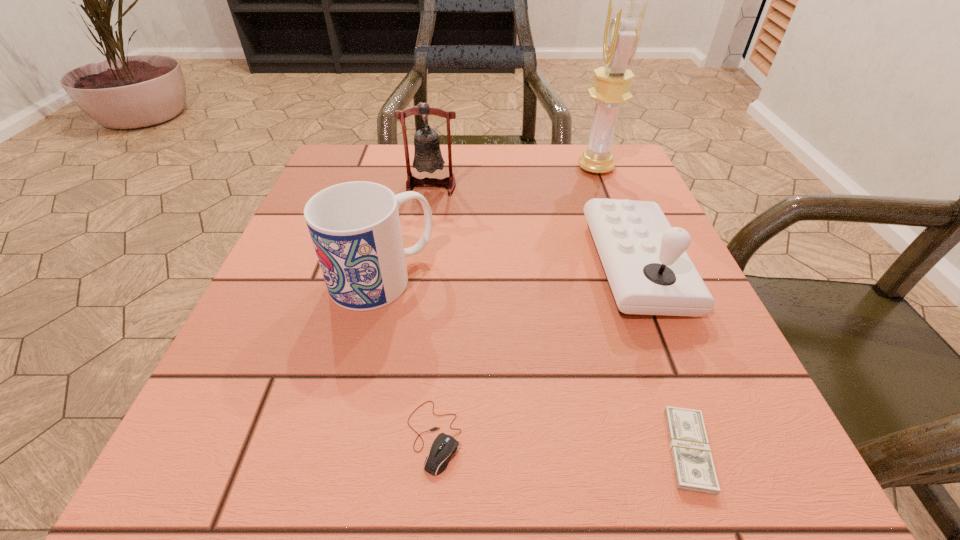
The height and width of the screenshot is (540, 960). What are the coordinates of `free space at the near right corner of the desktop` in the screenshot? It's located at (754, 468).

The image size is (960, 540). What are the coordinates of `free spot between the joystick and the second shortest object` in the screenshot? It's located at (535, 351).

What are the coordinates of `vacant space that is in between the computer mouse and the shortest object` in the screenshot? It's located at (561, 443).

Identify the location of blank region between the bell and the mug. (406, 232).

In order to click on empty space that is in between the award and the bell in this screenshot , I will do `click(514, 177)`.

This screenshot has height=540, width=960. Identify the location of unoccupied area between the mug and the money. (535, 364).

You are a GUI agent. You are given a task and a screenshot of the screen. Output one action in this format:
    pyautogui.click(x=<x>, y=<y>)
    Task: Click on the free space between the joystick and the computer mouse
    The height and width of the screenshot is (540, 960).
    Given the screenshot: What is the action you would take?
    pyautogui.click(x=535, y=351)

Identify the location of the closest object to the joystick. Image resolution: width=960 pixels, height=540 pixels. (694, 470).

Image resolution: width=960 pixels, height=540 pixels. I want to click on the closest object to the money, so click(x=649, y=272).

Image resolution: width=960 pixels, height=540 pixels. Identify the location of free spot that satisfies the following two spatial constraints: 1. on the front side of the shortest object; 2. on the right side of the computer mouse. (432, 450).